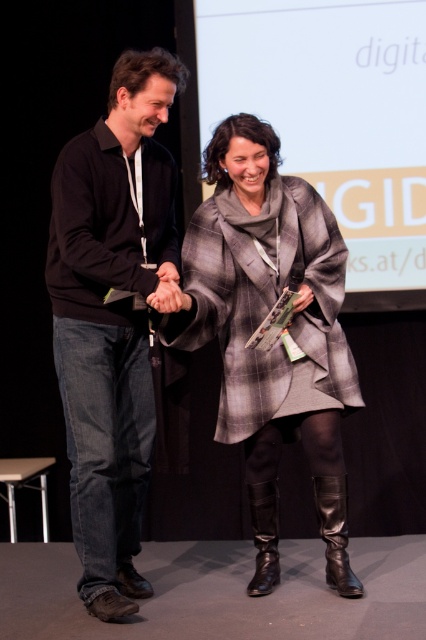
Question: Observing the image, what is the correct spatial positioning of black leather boot at lower right in reference to black leather boot at lower center?

Choices:
 (A) above
 (B) below

Answer: (A)

Question: Which point is farther to the camera?

Choices:
 (A) (245, 205)
 (B) (325, 516)

Answer: (B)

Question: Which point is closer to the camera taking this photo?

Choices:
 (A) (264, 566)
 (B) (345, 509)

Answer: (B)

Question: Which object is positioned closest to the plaid wool coat at center?

Choices:
 (A) black matte sweater at center
 (B) black leather boot at lower right
 (C) black leather boot at lower center

Answer: (A)

Question: Can you confirm if black matte sweater at center is positioned to the left of black leather boot at lower center?

Choices:
 (A) no
 (B) yes

Answer: (B)

Question: Is plaid wool coat at center below black leather boot at lower center?

Choices:
 (A) no
 (B) yes

Answer: (A)